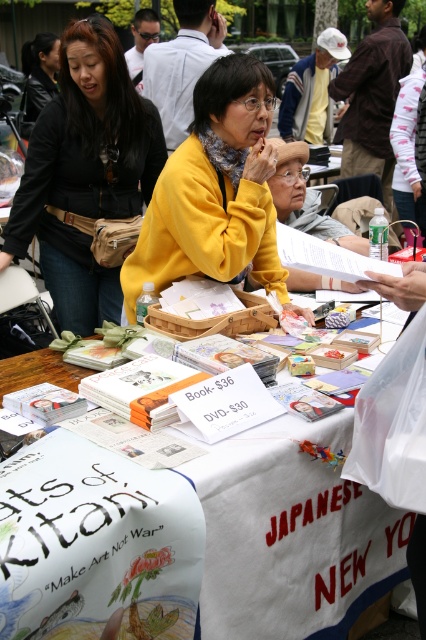
Does white fabric at center have a lesser width compared to matte black jacket at upper left?

Yes.

Is white fabric at center taller than matte black jacket at upper left?

In fact, white fabric at center may be shorter than matte black jacket at upper left.

The image size is (426, 640). Describe the element at coordinates (288, 532) in the screenshot. I see `white fabric at center` at that location.

What are the coordinates of `white fabric at center` in the screenshot? It's located at (288, 532).

What do you see at coordinates (288, 532) in the screenshot? I see `white fabric at center` at bounding box center [288, 532].

Measure the distance between point [342,513] and camera.

1.78 meters

I want to click on white fabric at center, so click(288, 532).

Can you confirm if matte black jacket at upper left is shorter than matte yellow sweater at center?

No.

Is matte black jacket at upper left above matte yellow sweater at center?

Correct, matte black jacket at upper left is located above matte yellow sweater at center.

Between point (17, 237) and point (259, 182), which one is positioned in front?

Point (259, 182) is more forward.

Identify the location of matte black jacket at upper left. (85, 173).